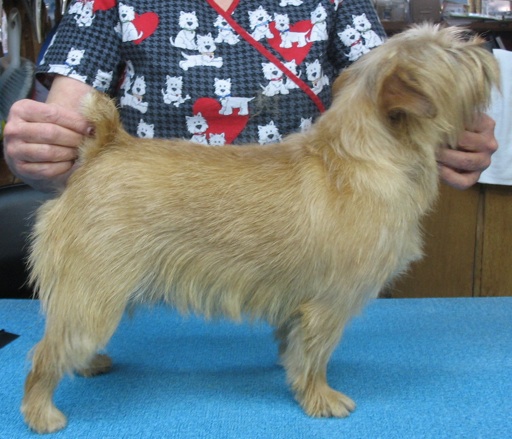
In order to click on wooden cabinet in this screenshot , I will do `click(469, 253)`, `click(458, 262)`.